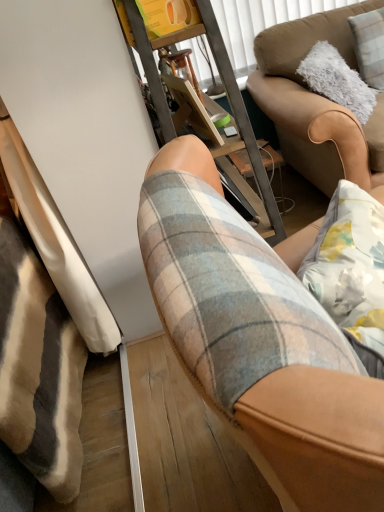
Question: Can you confirm if plaid fabric shorts at center is thinner than metal frame at center?

Choices:
 (A) no
 (B) yes

Answer: (A)

Question: Is plaid fabric shorts at center further to the viewer compared to metal frame at center?

Choices:
 (A) no
 (B) yes

Answer: (A)

Question: Does plaid fabric shorts at center lie in front of metal frame at center?

Choices:
 (A) yes
 (B) no

Answer: (A)

Question: Is plaid fabric shorts at center at the right side of metal frame at center?

Choices:
 (A) yes
 (B) no

Answer: (A)

Question: From a real-world perspective, is plaid fabric shorts at center located beneath metal frame at center?

Choices:
 (A) no
 (B) yes

Answer: (B)

Question: In the image, is metal frame at center on the left side or the right side of fluffy white pillow at upper right?

Choices:
 (A) right
 (B) left

Answer: (B)

Question: From the image's perspective, is metal frame at center above or below fluffy white pillow at upper right?

Choices:
 (A) below
 (B) above

Answer: (A)

Question: Considering the positions of metal frame at center and fluffy white pillow at upper right in the image, is metal frame at center wider or thinner than fluffy white pillow at upper right?

Choices:
 (A) wide
 (B) thin

Answer: (A)

Question: Is metal frame at center inside or outside of fluffy white pillow at upper right?

Choices:
 (A) inside
 (B) outside

Answer: (B)

Question: Is metal frame at center spatially inside plaid fabric shorts at center, or outside of it?

Choices:
 (A) outside
 (B) inside

Answer: (A)

Question: Visually, is metal frame at center positioned to the left or to the right of plaid fabric shorts at center?

Choices:
 (A) right
 (B) left

Answer: (B)

Question: Based on their sizes in the image, would you say metal frame at center is bigger or smaller than plaid fabric shorts at center?

Choices:
 (A) big
 (B) small

Answer: (A)

Question: In the image, is metal frame at center positioned in front of or behind plaid fabric shorts at center?

Choices:
 (A) front
 (B) behind

Answer: (B)

Question: From a real-world perspective, is plaid fabric shorts at center physically located above or below metal frame at center?

Choices:
 (A) below
 (B) above

Answer: (A)

Question: From the image's perspective, relative to metal frame at center, is plaid fabric shorts at center above or below?

Choices:
 (A) above
 (B) below

Answer: (B)